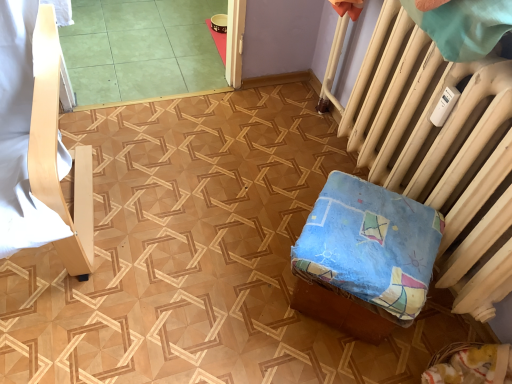
Where is `free point above blue fabric cushion at lower right, marked as the second furniture in a left-to-right arrangement (from a real-world perspective)`? free point above blue fabric cushion at lower right, marked as the second furniture in a left-to-right arrangement (from a real-world perspective) is located at coordinates (377, 225).